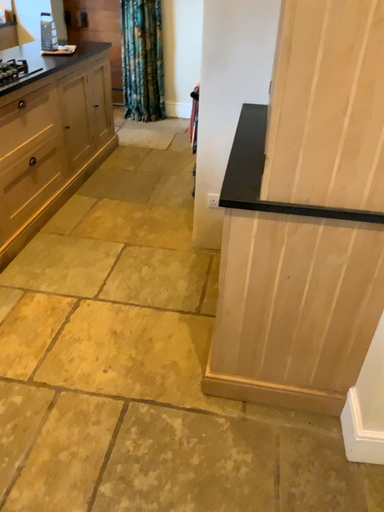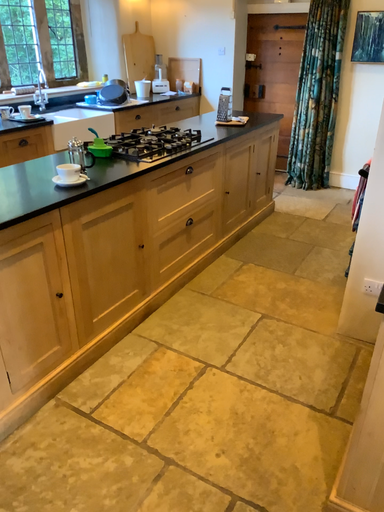
Question: How did the camera likely rotate when shooting the video?

Choices:
 (A) rotated right
 (B) rotated left

Answer: (B)